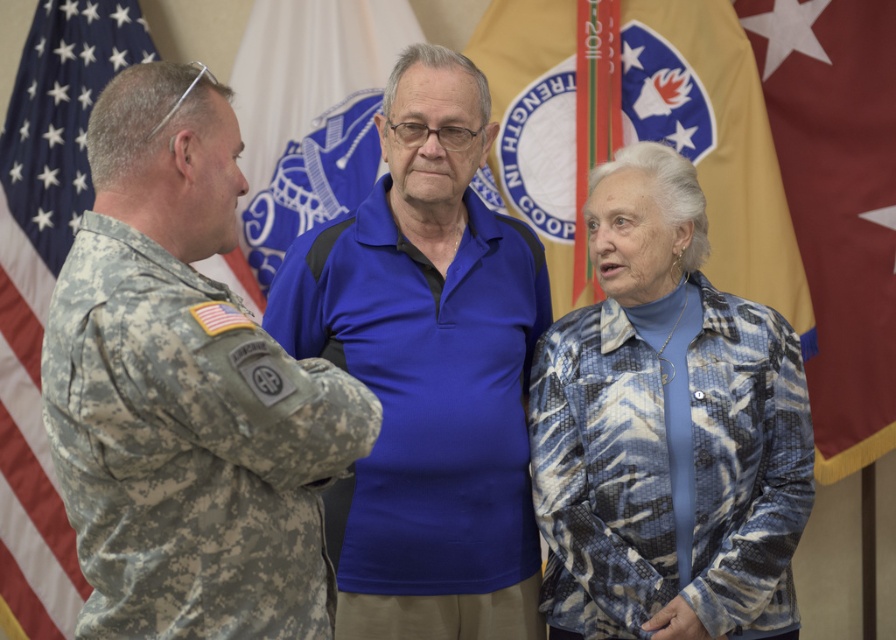
Does camouflage uniform at left have a lesser height compared to blue fabric flag at center?

Yes.

The width and height of the screenshot is (896, 640). I want to click on camouflage uniform at left, so click(185, 392).

Find the location of a particular element. This screenshot has width=896, height=640. camouflage uniform at left is located at coordinates (185, 392).

At what (x,y) coordinates should I click in order to perform the action: click on camouflage uniform at left. Please return your answer as a coordinate pair (x, y). This screenshot has height=640, width=896. Looking at the image, I should click on (185, 392).

Which is above, blue jersey at center or blue fabric flag at center?

blue fabric flag at center

The image size is (896, 640). In order to click on blue jersey at center in this screenshot , I will do 426,417.

Does point (490, 608) lie in front of point (359, 177)?

Yes, point (490, 608) is closer to viewer.

Locate an element on the screen. blue jersey at center is located at coordinates (426, 417).

Does blue textured jacket at center lie in front of camouflage fabric flag at left?

Yes, it is.

Which is behind, point (619, 573) or point (58, 576)?

The point (58, 576) is more distant.

Between point (616, 592) and point (16, 470), which one is positioned behind?

Positioned behind is point (16, 470).

Locate an element on the screen. The height and width of the screenshot is (640, 896). blue textured jacket at center is located at coordinates (666, 429).